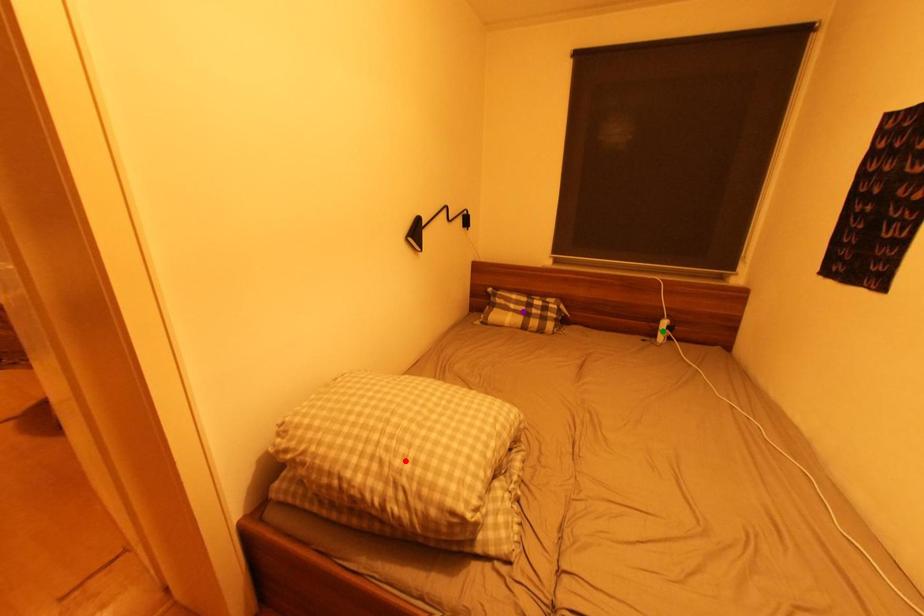
Order these from nearest to farthest:
green point
red point
purple point

1. red point
2. green point
3. purple point